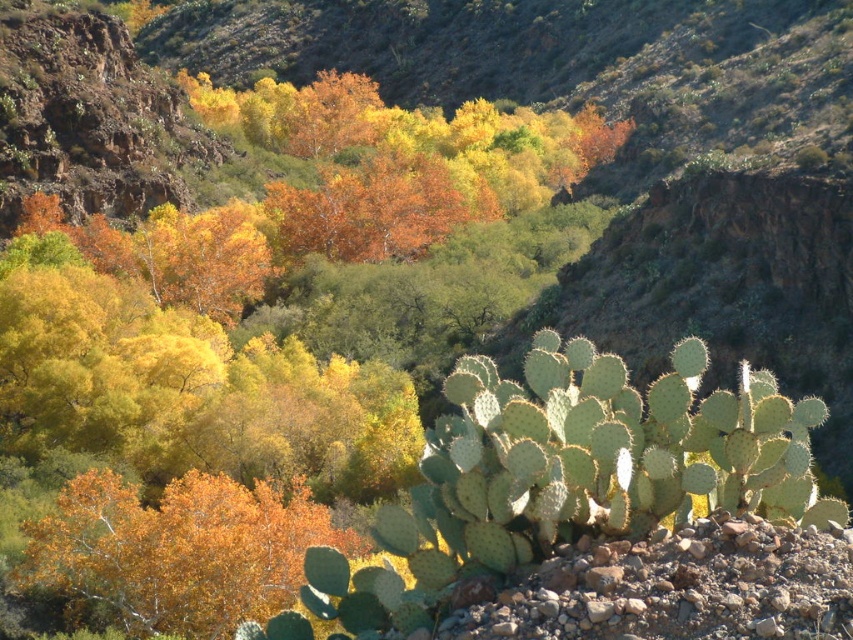
Question: Does golden textured leaves at center come in front of green spiny cactus at lower right?

Choices:
 (A) yes
 (B) no

Answer: (B)

Question: Which point is closer to the camera taking this photo?

Choices:
 (A) (85, 545)
 (B) (596, 554)

Answer: (B)

Question: Can you confirm if golden textured leaves at center is positioned to the right of green spiny cactus at lower right?

Choices:
 (A) yes
 (B) no

Answer: (B)

Question: Where is golden textured leaves at center located in relation to green spiny cactus at lower right in the image?

Choices:
 (A) right
 (B) left

Answer: (B)